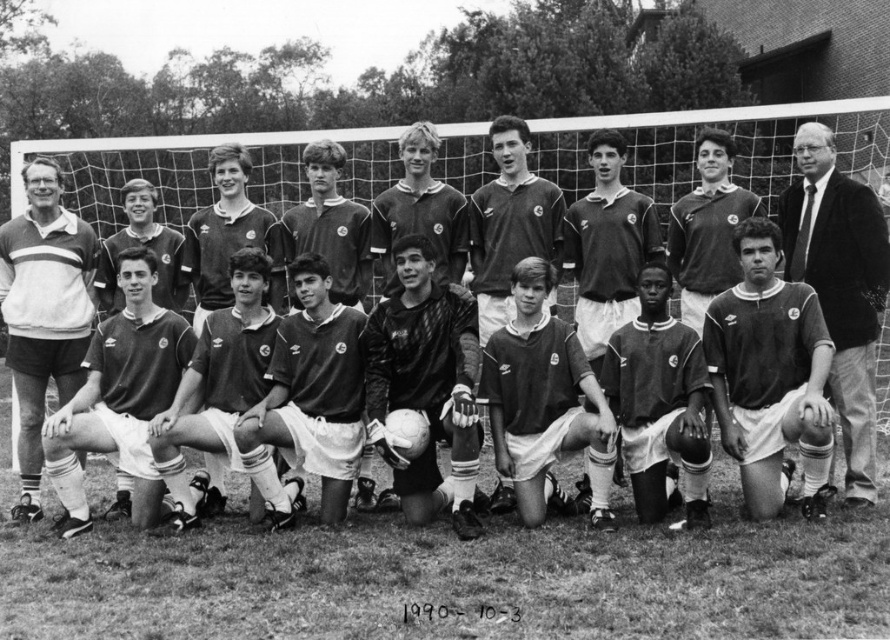
Question: Based on their relative distances, which object is farther from the dark green jersey at center?

Choices:
 (A) smooth black suit at center
 (B) dark maroon jersey at center

Answer: (A)

Question: Can you confirm if dark maroon jersey at center is smaller than dark blue jersey at center?

Choices:
 (A) no
 (B) yes

Answer: (A)

Question: Does grass at lower center come behind dark green jersey at center?

Choices:
 (A) yes
 (B) no

Answer: (B)

Question: Among these objects, which one is farthest from the camera?

Choices:
 (A) smooth black suit at center
 (B) dark brown jersey at center
 (C) grass at lower center
 (D) dark blue jersey at center

Answer: (A)

Question: Is dark maroon jersey at center thinner than smooth black suit at center?

Choices:
 (A) no
 (B) yes

Answer: (A)

Question: Estimate the real-world distances between objects in this image. Which object is closer to the smooth black suit at center?

Choices:
 (A) striped sweater at left
 (B) dark maroon jersey at center

Answer: (B)